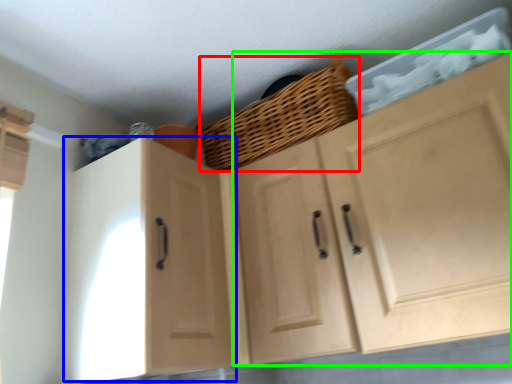
Question: Considering the real-world distances, which object is farthest from basket (highlighted by a red box)? cabinetry (highlighted by a blue box) or cabinetry (highlighted by a green box)?

Choices:
 (A) cabinetry
 (B) cabinetry

Answer: (A)